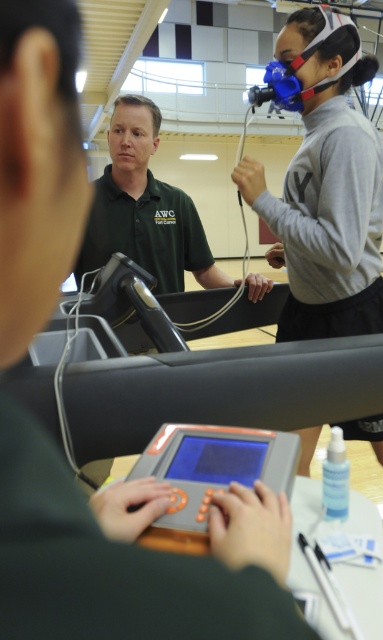
You are a fitness trainer trying to adjust the treadmill settings. You see the green matte shirt at center and the gray plastic tablet at center. Which object is bigger in size?

The green matte shirt at center has a larger size compared to the gray plastic tablet at center, so the green matte shirt at center is bigger.

Where is the green matte shirt at center located in the image?

The green matte shirt at center is located at point coordinates of (145, 209).